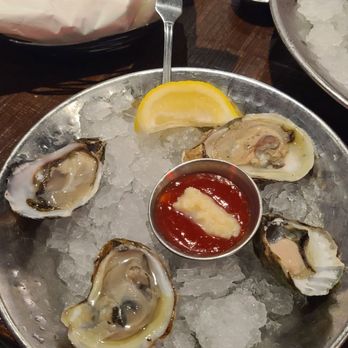
Locate an element on the screen. Image resolution: width=348 pixels, height=348 pixels. metal sauce dish is located at coordinates (181, 171).